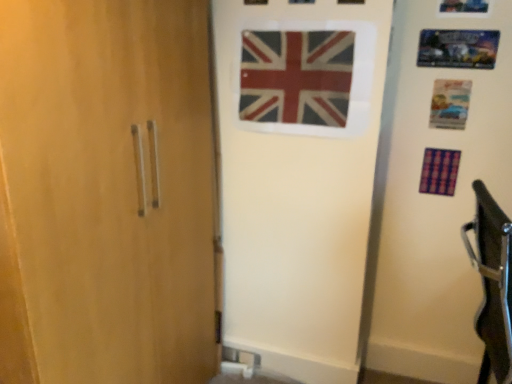
Question: From the image's perspective, is purple fabric flag at right, the 2th flag when ordered from front to back, under red and white fabric flag at center, marked as the 2th flag in a bottom-to-top arrangement?

Choices:
 (A) yes
 (B) no

Answer: (A)

Question: Is purple fabric flag at right, arranged as the 1th flag when ordered from the bottom, beside red and white fabric flag at center, the 1th flag when ordered from left to right?

Choices:
 (A) yes
 (B) no

Answer: (B)

Question: Does purple fabric flag at right, which is counted as the first flag, starting from the right, have a lesser height compared to red and white fabric flag at center, the 1th flag from the top?

Choices:
 (A) yes
 (B) no

Answer: (A)

Question: Is purple fabric flag at right, arranged as the 1th flag when ordered from the bottom, to the right of red and white fabric flag at center, the 1th flag when ordered from left to right, from the viewer's perspective?

Choices:
 (A) yes
 (B) no

Answer: (A)

Question: Is the position of purple fabric flag at right, acting as the 1th flag starting from the back, less distant than that of red and white fabric flag at center, which is the 2th flag in right-to-left order?

Choices:
 (A) yes
 (B) no

Answer: (B)

Question: Is purple fabric flag at right, the 2th flag when ordered from front to back, further to the viewer compared to red and white fabric flag at center, which is the 2th flag in right-to-left order?

Choices:
 (A) no
 (B) yes

Answer: (B)

Question: Is red and white fabric flag at center, which is the 2th flag in right-to-left order, next to purple fabric flag at right, which is the second flag in left-to-right order?

Choices:
 (A) yes
 (B) no

Answer: (B)

Question: From a real-world perspective, is red and white fabric flag at center, the 1th flag from the top, located beneath purple fabric flag at right, which is the second flag in left-to-right order?

Choices:
 (A) yes
 (B) no

Answer: (B)

Question: Does red and white fabric flag at center, marked as the 2th flag in a bottom-to-top arrangement, have a larger size compared to purple fabric flag at right, placed as the second flag when sorted from top to bottom?

Choices:
 (A) yes
 (B) no

Answer: (A)

Question: Considering the relative sizes of red and white fabric flag at center, positioned as the 2th flag in back-to-front order, and purple fabric flag at right, acting as the 1th flag starting from the back, in the image provided, is red and white fabric flag at center, positioned as the 2th flag in back-to-front order, wider than purple fabric flag at right, acting as the 1th flag starting from the back,?

Choices:
 (A) yes
 (B) no

Answer: (B)

Question: Does red and white fabric flag at center, which is counted as the 1th flag, starting from the front, have a greater height compared to purple fabric flag at right, placed as the second flag when sorted from top to bottom?

Choices:
 (A) no
 (B) yes

Answer: (B)

Question: Visually, is red and white fabric flag at center, the 1th flag when ordered from left to right, positioned to the left or to the right of purple fabric flag at right, the 2th flag when ordered from front to back?

Choices:
 (A) right
 (B) left

Answer: (B)